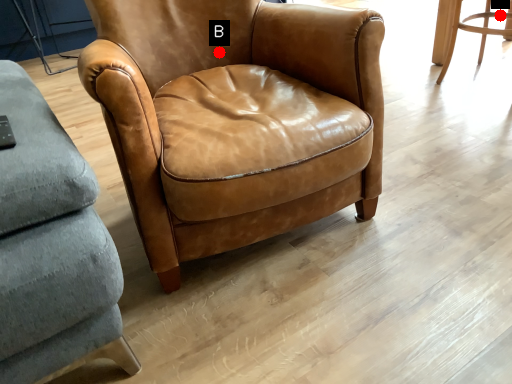
Question: Two points are circled on the image, labeled by A and B beside each circle. Which of the following is the closest to the observer?

Choices:
 (A) A is closer
 (B) B is closer

Answer: (B)